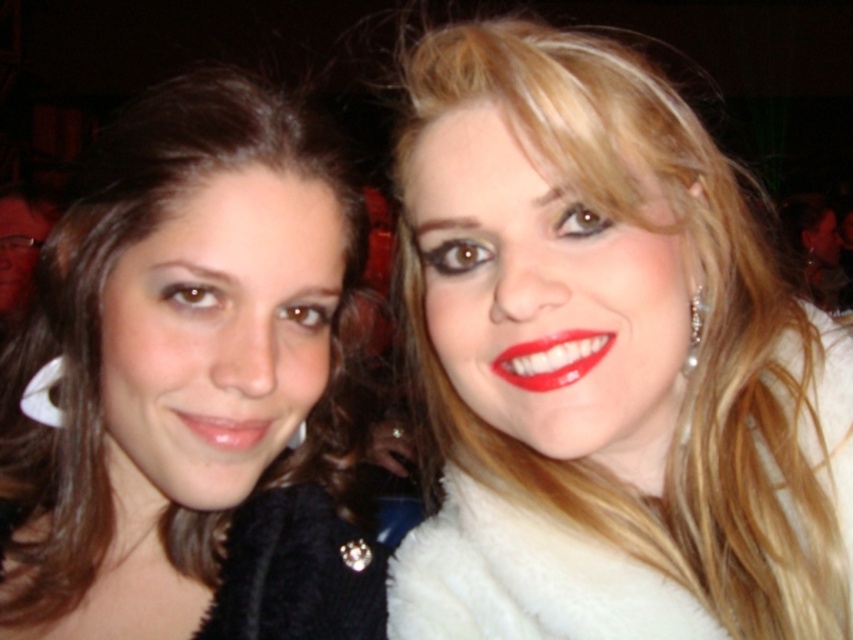
You are a photographer trying to adjust the lighting for a portrait. You need to place a spotlight exactly at the location of the white fur coat at right. What are the coordinates where you should position the spotlight?

The coordinates for the white fur coat at right are at point [607,362], so you should position the spotlight there.

You are a photographer adjusting the focus of your camera. You notice a point at coordinates (552, 358) in the image. What object is located at this point?

The point at coordinates (552, 358) marks the location of the matte red lipstick at center.

You are taking a photo of two people standing in front of a red curtain. There are two points marked on the image at coordinates point [634,588] and point [500,376]. If you want to focus on the closer point to ensure the photo is clear, which coordinate should you choose?

Point [500,376] is closer to the camera than point [634,588], so you should focus on point [500,376] to ensure the photo is clear.